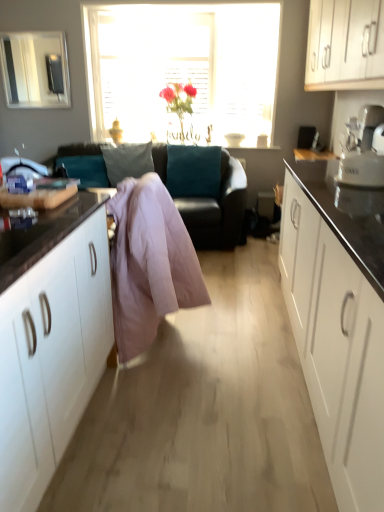
Question: Is teal leather couch at center closer to camera compared to translucent glass vase at center?

Choices:
 (A) no
 (B) yes

Answer: (B)

Question: Is teal leather couch at center smaller than translucent glass vase at center?

Choices:
 (A) no
 (B) yes

Answer: (A)

Question: Does teal leather couch at center have a lesser width compared to translucent glass vase at center?

Choices:
 (A) yes
 (B) no

Answer: (B)

Question: From a real-world perspective, is teal leather couch at center beneath translucent glass vase at center?

Choices:
 (A) yes
 (B) no

Answer: (A)

Question: Is teal leather couch at center outside translucent glass vase at center?

Choices:
 (A) no
 (B) yes

Answer: (B)

Question: Considering the positions of clear glass window screen at upper left and teal leather couch at center in the image, is clear glass window screen at upper left bigger or smaller than teal leather couch at center?

Choices:
 (A) big
 (B) small

Answer: (B)

Question: Considering the positions of clear glass window screen at upper left and teal leather couch at center in the image, is clear glass window screen at upper left wider or thinner than teal leather couch at center?

Choices:
 (A) wide
 (B) thin

Answer: (B)

Question: From a real-world perspective, is clear glass window screen at upper left positioned above or below teal leather couch at center?

Choices:
 (A) above
 (B) below

Answer: (A)

Question: In terms of height, does clear glass window screen at upper left look taller or shorter compared to teal leather couch at center?

Choices:
 (A) tall
 (B) short

Answer: (B)

Question: From a real-world perspective, relative to light pink fabric at center, is white glossy cabinets at upper right vertically above or below?

Choices:
 (A) above
 (B) below

Answer: (A)

Question: In terms of height, does white glossy cabinets at upper right look taller or shorter compared to light pink fabric at center?

Choices:
 (A) tall
 (B) short

Answer: (B)

Question: Relative to light pink fabric at center, is white glossy cabinets at upper right in front or behind?

Choices:
 (A) front
 (B) behind

Answer: (A)

Question: Visually, is white glossy cabinets at upper right positioned to the left or to the right of light pink fabric at center?

Choices:
 (A) right
 (B) left

Answer: (A)

Question: Considering the positions of white glossy cabinets at upper right and translucent glass vase at center in the image, is white glossy cabinets at upper right taller or shorter than translucent glass vase at center?

Choices:
 (A) short
 (B) tall

Answer: (A)

Question: Based on their sizes in the image, would you say white glossy cabinets at upper right is bigger or smaller than translucent glass vase at center?

Choices:
 (A) big
 (B) small

Answer: (B)